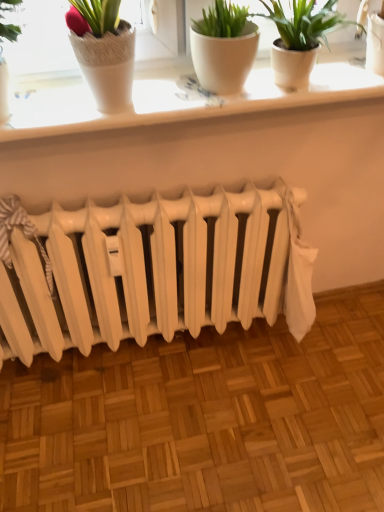
Find the location of a particular element. Image resolution: width=384 pixels, height=512 pixels. free spot above white ceramic window sill at upper center (from a real-world perspective) is located at coordinates (223, 92).